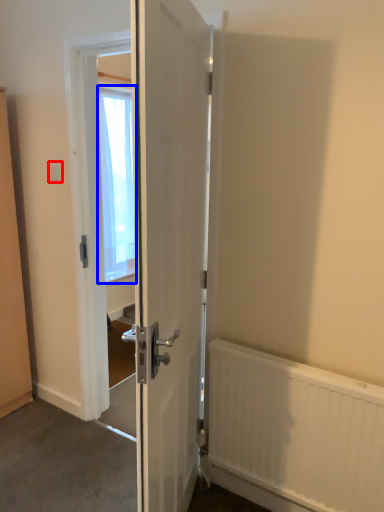
Question: Which of the following is the farthest to the observer, electric outlet (highlighted by a red box) or window screen (highlighted by a blue box)?

Choices:
 (A) electric outlet
 (B) window screen

Answer: (B)